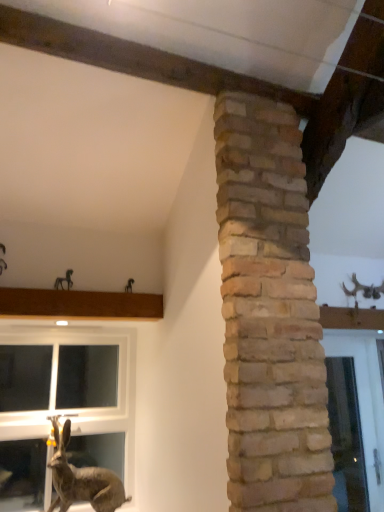
Question: Does clear glass window at lower left come behind metallic horse at upper left?

Choices:
 (A) yes
 (B) no

Answer: (B)

Question: Is clear glass window at lower left next to metallic horse at upper left?

Choices:
 (A) yes
 (B) no

Answer: (B)

Question: Is clear glass window at lower left to the left of metallic horse at upper left from the viewer's perspective?

Choices:
 (A) no
 (B) yes

Answer: (B)

Question: Is metallic horse at upper left at the back of clear glass window at lower left?

Choices:
 (A) yes
 (B) no

Answer: (B)

Question: Considering the relative sizes of clear glass window at lower left and metallic horse at upper left in the image provided, is clear glass window at lower left bigger than metallic horse at upper left?

Choices:
 (A) no
 (B) yes

Answer: (B)

Question: Is brown textured rabbit at lower left situated inside clear glass window at lower left or outside?

Choices:
 (A) inside
 (B) outside

Answer: (B)

Question: Is point coord(120,497) closer or farther from the camera than point coord(11,376)?

Choices:
 (A) closer
 (B) farther

Answer: (A)

Question: From their relative heights in the image, would you say brown textured rabbit at lower left is taller or shorter than clear glass window at lower left?

Choices:
 (A) tall
 (B) short

Answer: (B)

Question: From a real-world perspective, is brown textured rabbit at lower left positioned above or below clear glass window at lower left?

Choices:
 (A) below
 (B) above

Answer: (A)

Question: Do you think brown wood at upper left is within brown textured rabbit at lower left, or outside of it?

Choices:
 (A) outside
 (B) inside

Answer: (A)

Question: Considering the positions of brown wood at upper left and brown textured rabbit at lower left in the image, is brown wood at upper left bigger or smaller than brown textured rabbit at lower left?

Choices:
 (A) big
 (B) small

Answer: (B)

Question: Considering their positions, is brown wood at upper left located in front of or behind brown textured rabbit at lower left?

Choices:
 (A) behind
 (B) front

Answer: (A)

Question: From the image's perspective, is brown wood at upper left located above or below brown textured rabbit at lower left?

Choices:
 (A) above
 (B) below

Answer: (A)

Question: Based on their positions, is brown wood at upper left located to the left or right of clear glass window at lower left?

Choices:
 (A) right
 (B) left

Answer: (A)

Question: Relative to clear glass window at lower left, is brown wood at upper left in front or behind?

Choices:
 (A) front
 (B) behind

Answer: (A)